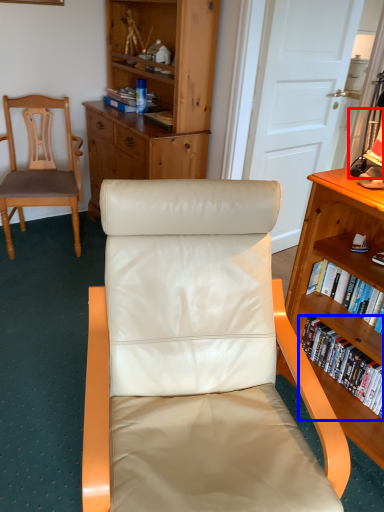
Question: Among these objects, which one is nearest to the camera, lamp (highlighted by a red box) or book (highlighted by a blue box)?

Choices:
 (A) lamp
 (B) book

Answer: (A)